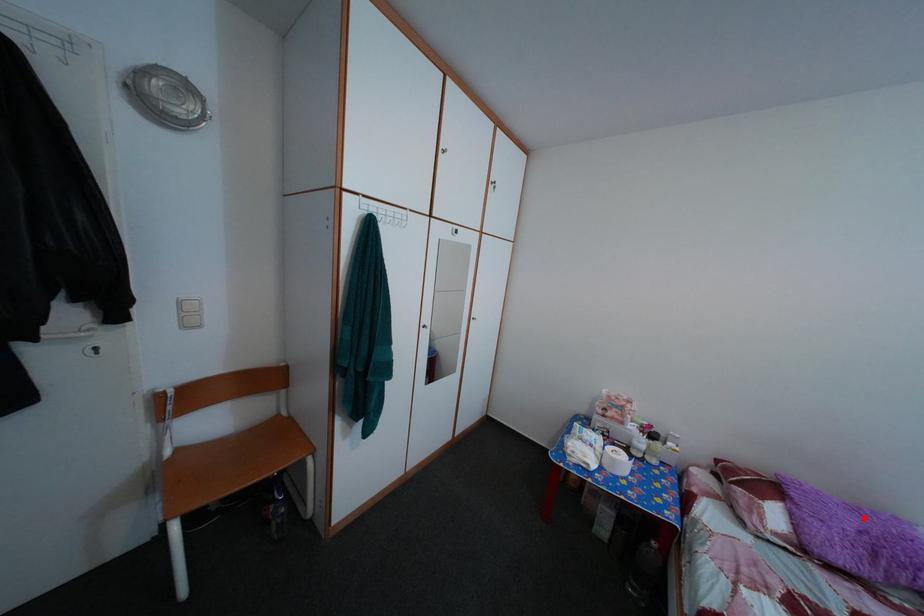
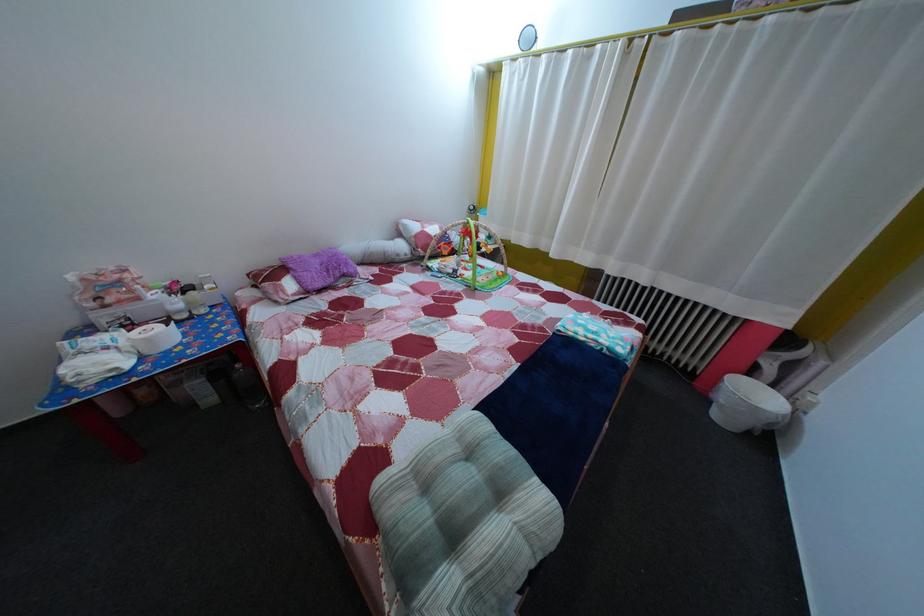
Where in the second image is the point corresponding to the highlighted location from the first image?

(325, 262)